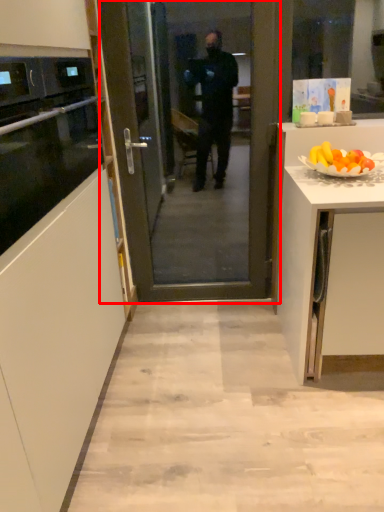
Question: From the image's perspective, where is screen door (annotated by the red box) located in relation to oven in the image?

Choices:
 (A) below
 (B) above

Answer: (A)